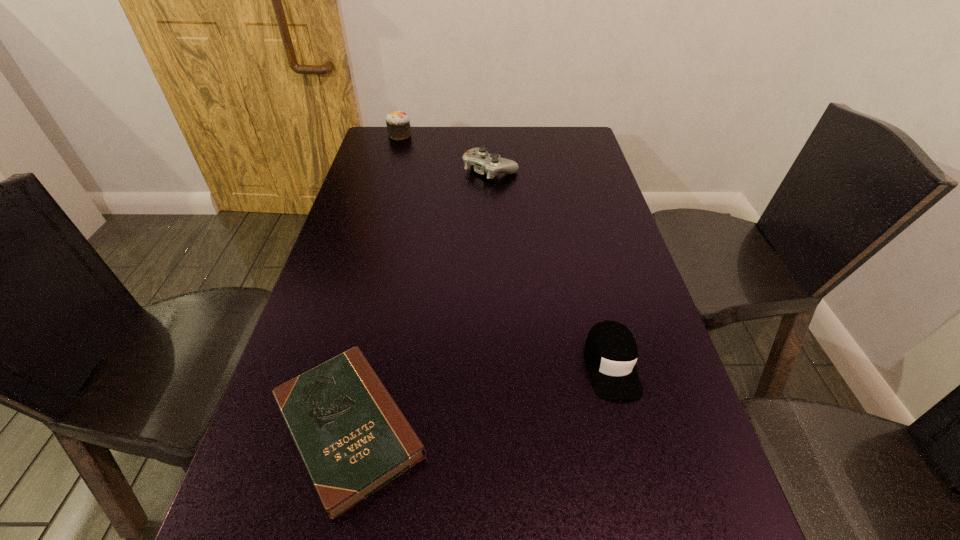
Where is `the tallest object`? the tallest object is located at coordinates (398, 126).

The height and width of the screenshot is (540, 960). I want to click on the farthest object, so click(x=398, y=126).

At what (x,y) coordinates should I click in order to perform the action: click on control. Please return your answer as a coordinate pair (x, y). This screenshot has width=960, height=540. Looking at the image, I should click on (492, 164).

Locate an element on the screen. the third nearest object is located at coordinates (492, 164).

Identify the location of cap. The image size is (960, 540). (611, 350).

This screenshot has width=960, height=540. I want to click on the shortest object, so click(353, 439).

In order to click on free space located on the front of the farthest object in this screenshot , I will do `click(391, 166)`.

You are a GUI agent. You are given a task and a screenshot of the screen. Output one action in this format:
    pyautogui.click(x=<x>, y=<y>)
    Task: Click on the free space located on the right of the second farthest object
    
    Given the screenshot: What is the action you would take?
    pyautogui.click(x=555, y=170)

Where is `blank space located on the front-facing side of the rightmost object`? Image resolution: width=960 pixels, height=540 pixels. blank space located on the front-facing side of the rightmost object is located at coordinates (640, 477).

At what (x,y) coordinates should I click in order to perform the action: click on free region located 0.350m on the back of the shortest object. Please return your answer as a coordinate pair (x, y). This screenshot has height=540, width=960. Looking at the image, I should click on pos(390,247).